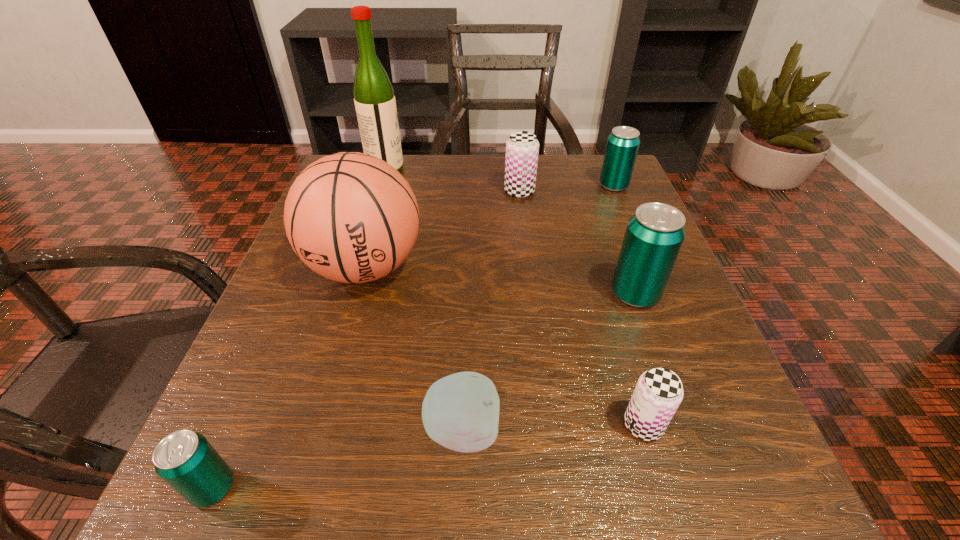
Locate an element on the screen. liquor is located at coordinates (374, 99).

The width and height of the screenshot is (960, 540). In order to click on green liquor in this screenshot , I will do `click(374, 99)`.

I want to click on basketball, so click(351, 217).

Where is `orange basketball`? orange basketball is located at coordinates (351, 217).

Where is `the third tallest object`? This screenshot has height=540, width=960. the third tallest object is located at coordinates [x=654, y=235].

This screenshot has height=540, width=960. Find the location of `the second nearest teal beer can`. the second nearest teal beer can is located at coordinates (654, 235).

Where is `the fifth object from left to right`? Image resolution: width=960 pixels, height=540 pixels. the fifth object from left to right is located at coordinates (522, 148).

Where is `the farther purple beer can`? the farther purple beer can is located at coordinates (522, 148).

This screenshot has height=540, width=960. I want to click on the farthest teal beer can, so click(623, 143).

Image resolution: width=960 pixels, height=540 pixels. Identify the location of white apple. (460, 412).